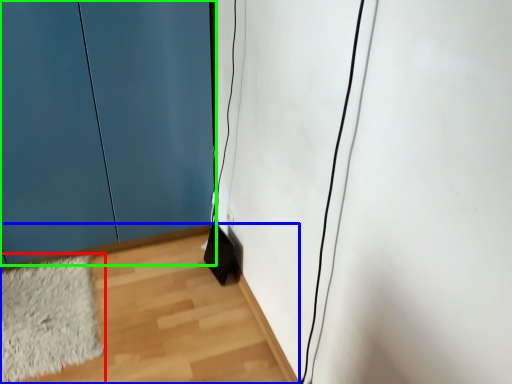
Question: Which is farther away from mat (highlighted by a red box)? corridor (highlighted by a blue box) or door (highlighted by a green box)?

Choices:
 (A) corridor
 (B) door

Answer: (B)